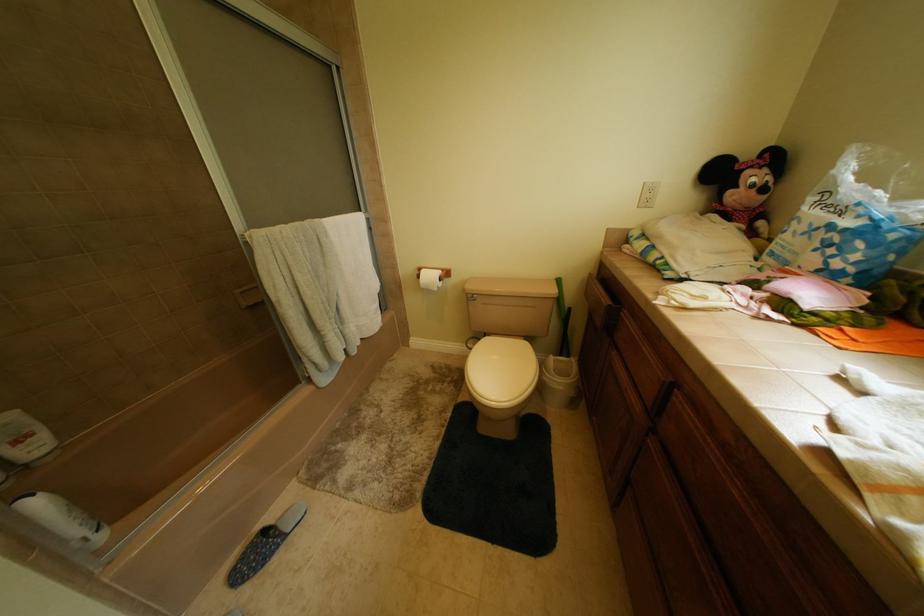
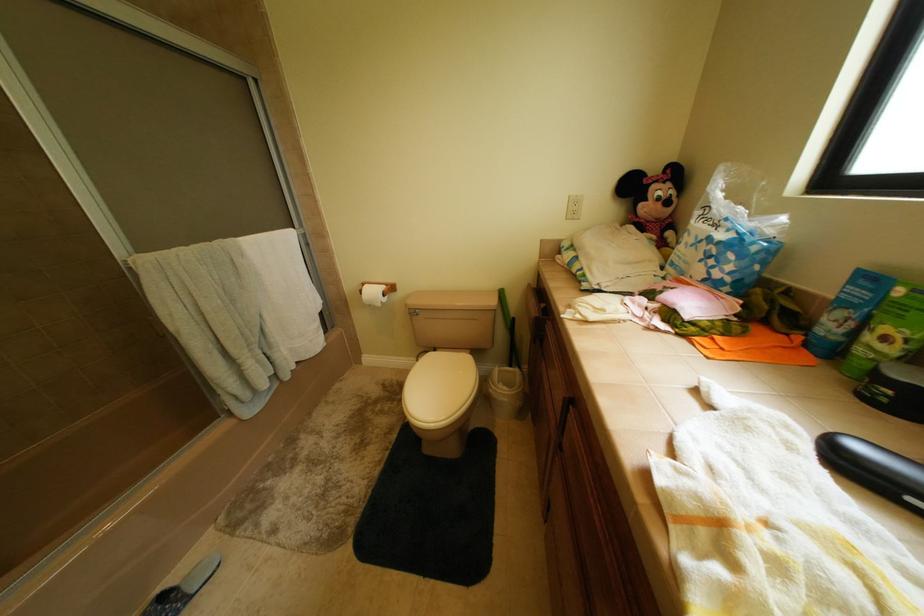
Question: The camera is either moving clockwise (left) or counter-clockwise (right) around the object. The first image is from the beginning of the video and the second image is from the end. Is the camera moving left or right when shooting the video?

Choices:
 (A) Left
 (B) Right

Answer: (A)